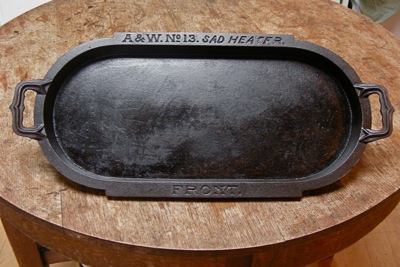
Identify the location of table legs. (16, 249).